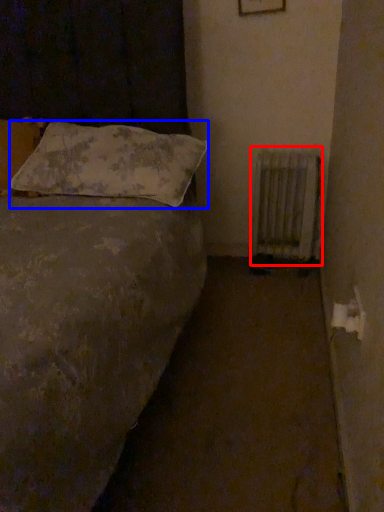
Question: Which point is closer to the camera, radiator (highlighted by a red box) or pillow (highlighted by a blue box)?

Choices:
 (A) radiator
 (B) pillow

Answer: (B)